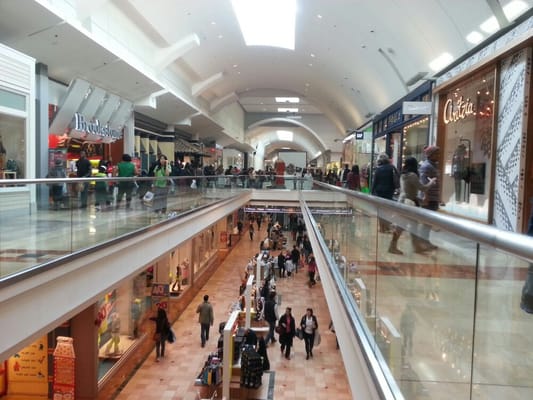
At what (x,y) coordinates should I click in order to perform the action: click on ceiling. Please return your answer as a coordinate pair (x, y). The width and height of the screenshot is (533, 400). Looking at the image, I should click on point(340,83).